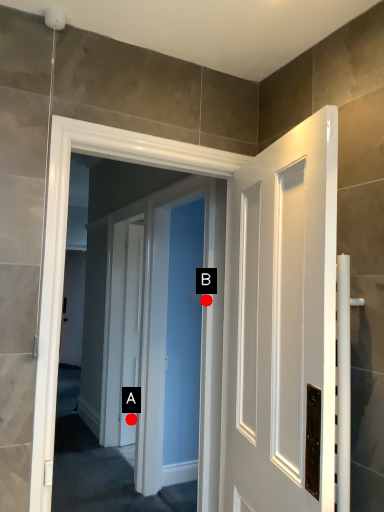
Question: Two points are circled on the image, labeled by A and B beside each circle. Which point is closer to the camera?

Choices:
 (A) A is closer
 (B) B is closer

Answer: (B)